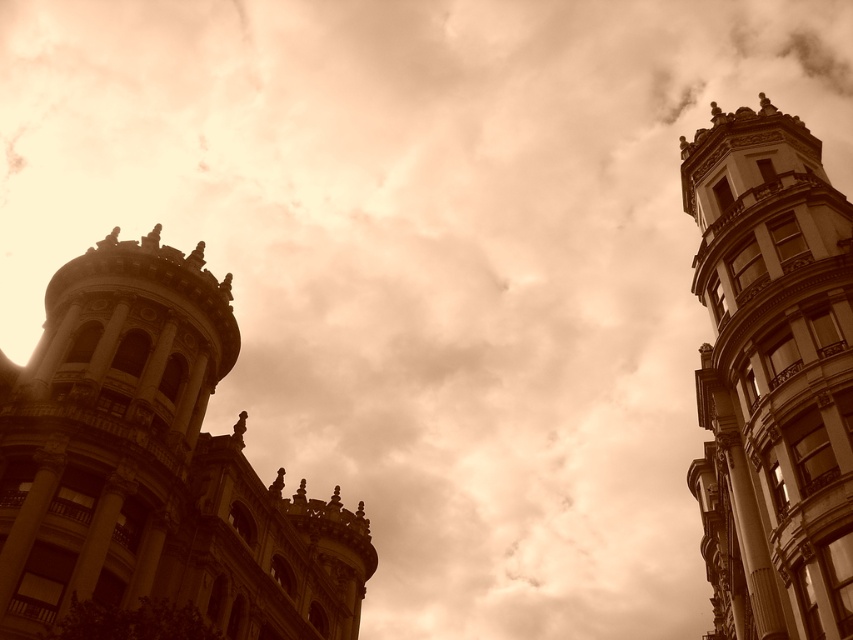
Can you confirm if sepia stone tower at left is positioned to the left of smooth stone tower at right?

Correct, you'll find sepia stone tower at left to the left of smooth stone tower at right.

Which is above, sepia stone tower at left or smooth stone tower at right?

smooth stone tower at right is above.

Which is behind, point (154, 552) or point (750, 468)?

Point (750, 468)

Find the location of a particular element. sepia stone tower at left is located at coordinates pyautogui.click(x=155, y=465).